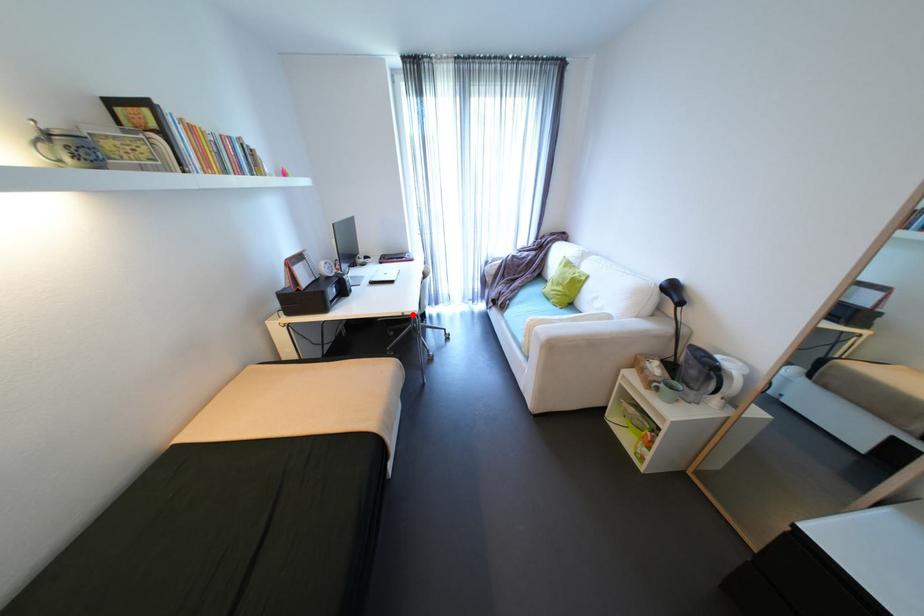
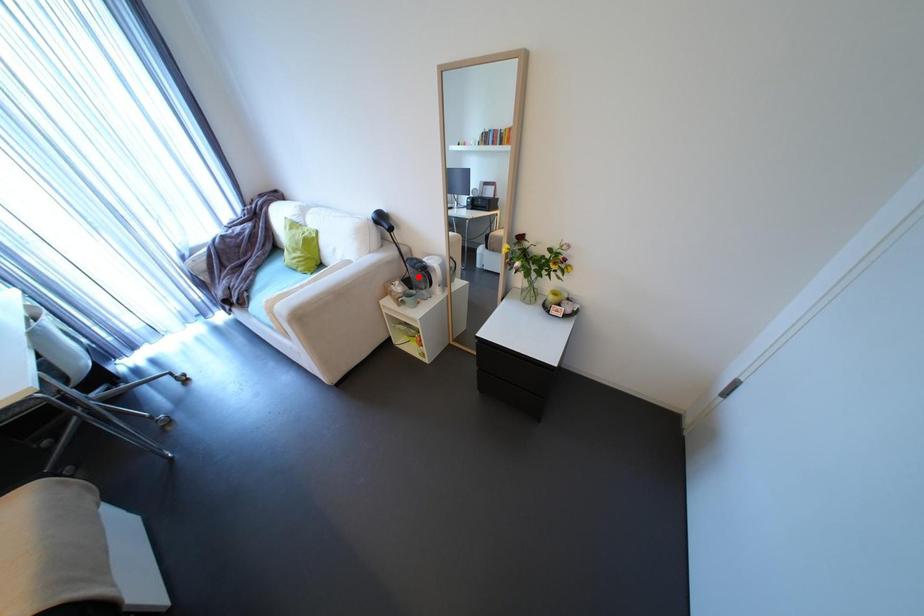
Looking at this image, I am providing you with two images of the same scene from different viewpoints. A red point is marked on the first image and another point is marked on the second image. Is the marked point in image1 the same physical position as the marked point in image2?

No